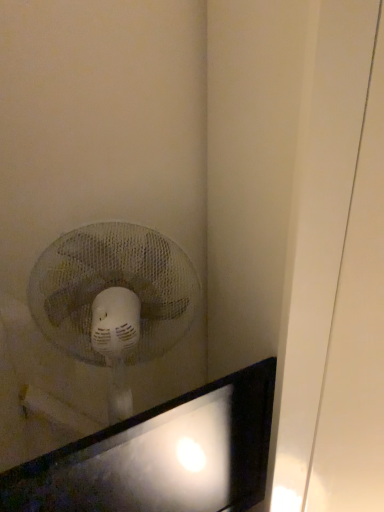
Question: Should I look upward or downward to see white plastic fan at upper left?

Choices:
 (A) down
 (B) up

Answer: (A)

Question: From a real-world perspective, is white plastic fan at upper left on matte black monitor at lower left?

Choices:
 (A) yes
 (B) no

Answer: (A)

Question: From the image's perspective, is white plastic fan at upper left on matte black monitor at lower left?

Choices:
 (A) yes
 (B) no

Answer: (A)

Question: Is white plastic fan at upper left touching matte black monitor at lower left?

Choices:
 (A) no
 (B) yes

Answer: (A)

Question: Is matte black monitor at lower left a part of white plastic fan at upper left?

Choices:
 (A) no
 (B) yes

Answer: (A)

Question: Is white plastic fan at upper left wider than matte black monitor at lower left?

Choices:
 (A) yes
 (B) no

Answer: (A)

Question: Can you confirm if white plastic fan at upper left is positioned to the left of matte black monitor at lower left?

Choices:
 (A) yes
 (B) no

Answer: (A)

Question: Considering the relative positions of matte black monitor at lower left and white plastic fan at upper left in the image provided, is matte black monitor at lower left to the left of white plastic fan at upper left from the viewer's perspective?

Choices:
 (A) yes
 (B) no

Answer: (B)

Question: Considering the relative positions of matte black monitor at lower left and white plastic fan at upper left in the image provided, is matte black monitor at lower left to the right of white plastic fan at upper left from the viewer's perspective?

Choices:
 (A) no
 (B) yes

Answer: (B)

Question: Considering the relative positions of matte black monitor at lower left and white plastic fan at upper left in the image provided, is matte black monitor at lower left behind white plastic fan at upper left?

Choices:
 (A) yes
 (B) no

Answer: (B)

Question: Is matte black monitor at lower left next to white plastic fan at upper left and touching it?

Choices:
 (A) no
 (B) yes

Answer: (A)

Question: Is matte black monitor at lower left bigger than white plastic fan at upper left?

Choices:
 (A) no
 (B) yes

Answer: (A)

Question: Is matte black monitor at lower left not near white plastic fan at upper left?

Choices:
 (A) no
 (B) yes

Answer: (A)

Question: Do you think matte black monitor at lower left is within white plastic fan at upper left, or outside of it?

Choices:
 (A) inside
 (B) outside

Answer: (B)